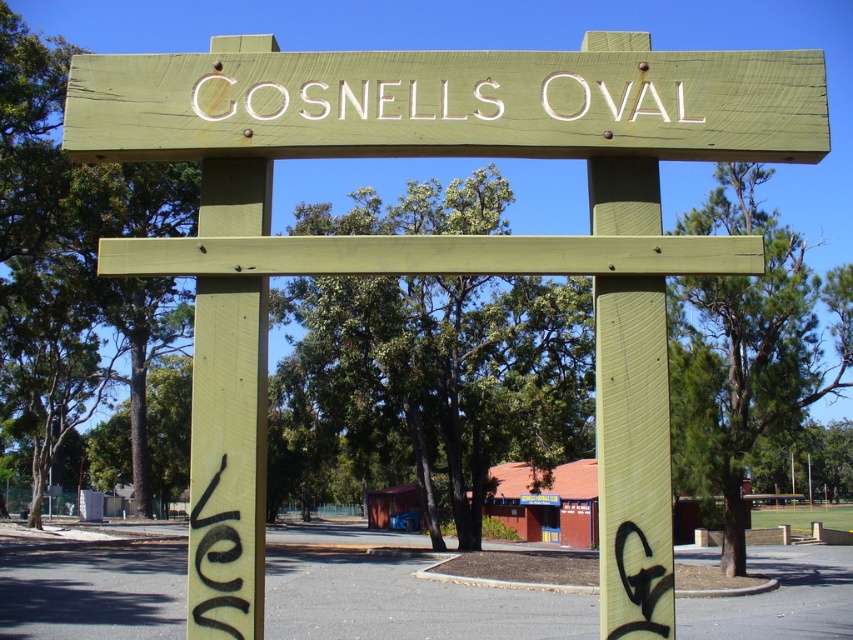
Based on the photo, you are standing at the base of the archway and want to place a small decoration. You have two points marked on a grid overlaying the image at coordinates point (412, 124) and point (631, 90). Which point is closer to you?

Point (412, 124) is closer to you because it is in front of point (631, 90).

Based on the photo, you are standing in front of the archway and want to read both the green wood sign at center and the white painted wood sign at center. Which sign do you need to look up higher to see?

The green wood sign at center is located above the white painted wood sign at center, so you need to look up higher to see the green wood sign at center.

You are standing at the base of the archway looking up. There is a point marked at coordinates [448,104]. Which object does this point belong to?

The point at [448,104] is on the green wood sign at center.